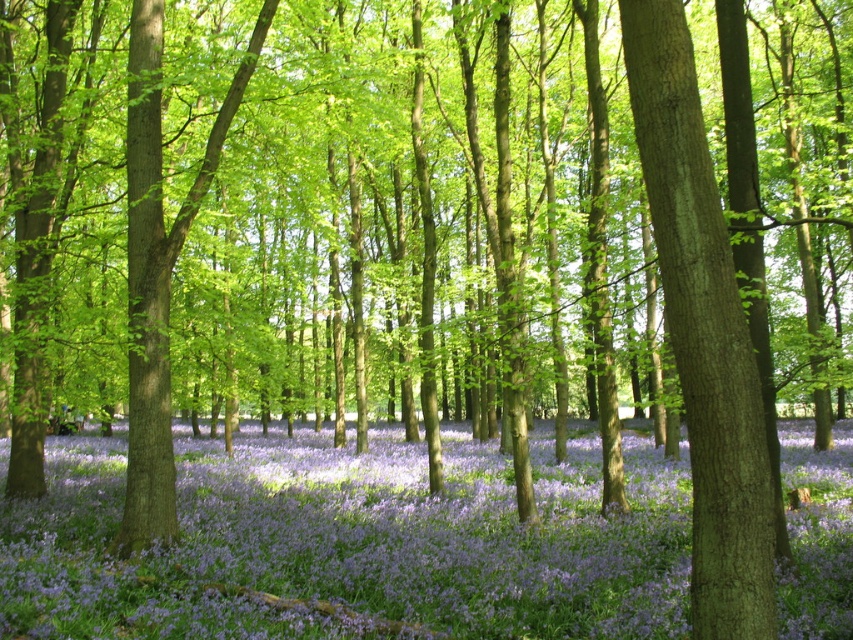
Between purple matte flower at center and green rough bark tree at center, which one appears on the right side from the viewer's perspective?

Positioned to the right is green rough bark tree at center.

Who is more distant from viewer, (x=463, y=529) or (x=660, y=0)?

The point (x=463, y=529) is more distant.

You are a GUI agent. You are given a task and a screenshot of the screen. Output one action in this format:
    pyautogui.click(x=<x>, y=<y>)
    Task: Click on the purple matte flower at center
    
    Given the screenshot: What is the action you would take?
    pyautogui.click(x=351, y=544)